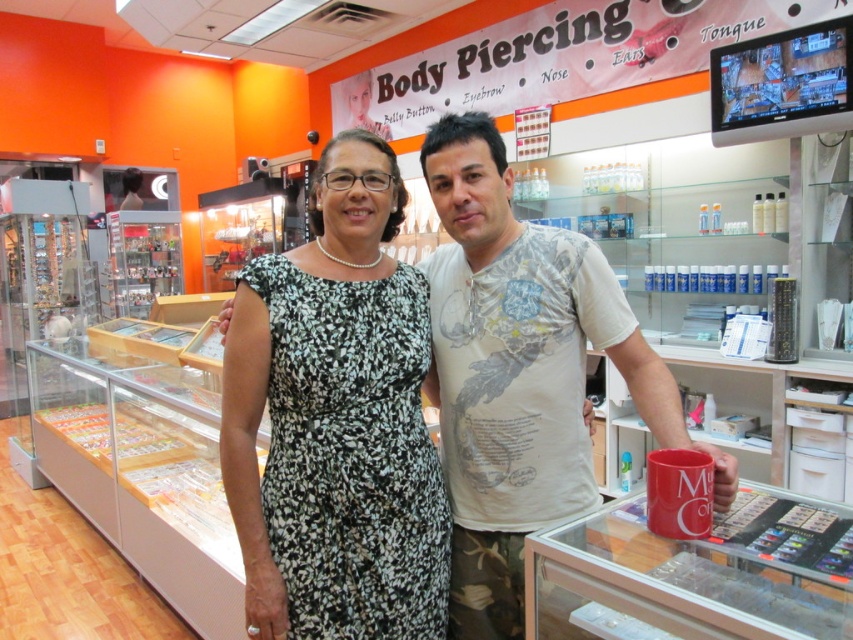
Is point (369, 474) closer to camera compared to point (505, 621)?

Yes.

You are a GUI agent. You are given a task and a screenshot of the screen. Output one action in this format:
    pyautogui.click(x=<x>, y=<y>)
    Task: Click on the black floral dress at center
    
    Given the screenshot: What is the action you would take?
    pyautogui.click(x=335, y=420)

Is point (346, 221) positioned in front of point (471, 401)?

Yes, it is.

Image resolution: width=853 pixels, height=640 pixels. I want to click on black floral dress at center, so click(x=335, y=420).